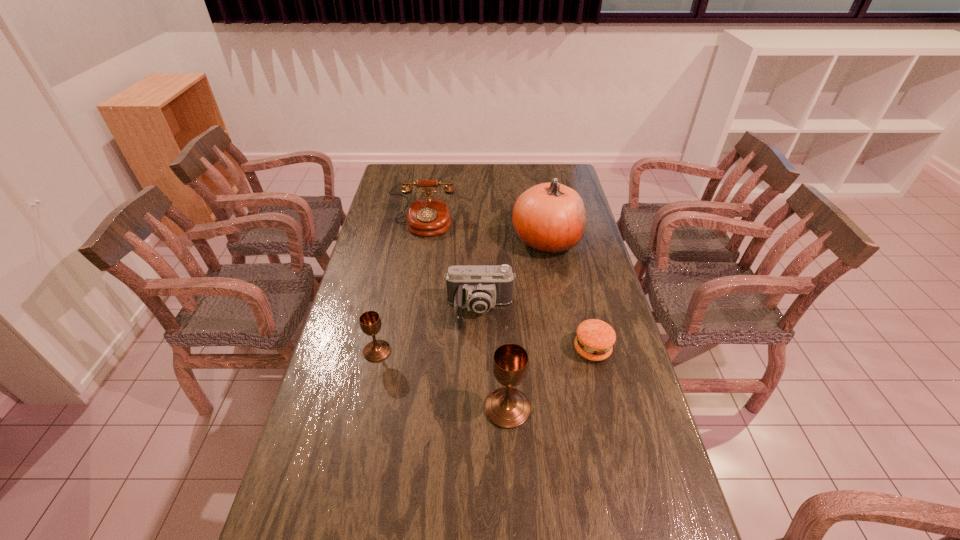
Considering the uniform spacing of chalices, where should an additional chalice be positioned on the right? Please locate a free spot. Please provide its 2D coordinates. Your answer should be formatted as a tuple, i.e. [(x, y)], where the tuple contains the x and y coordinates of a point satisfying the conditions above.

[(673, 481)]